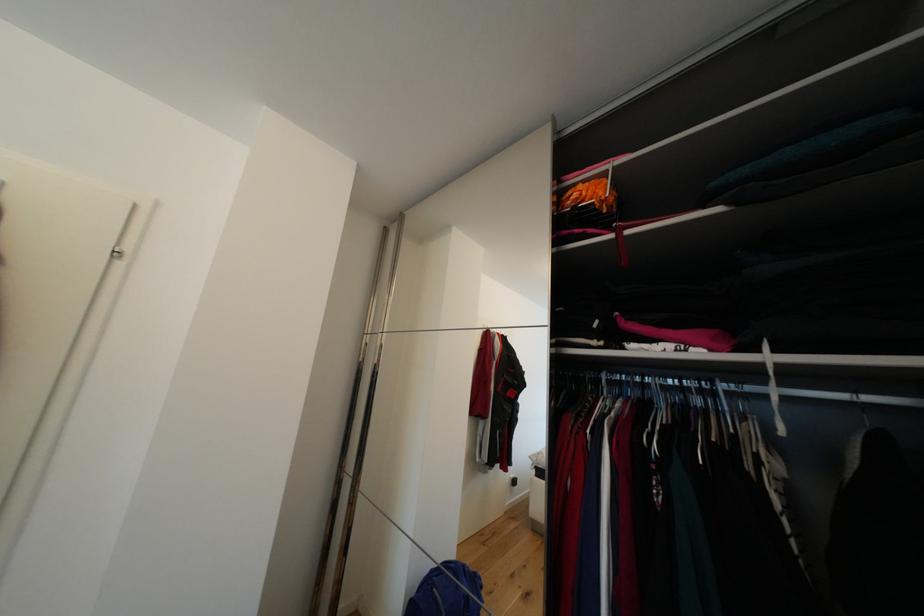
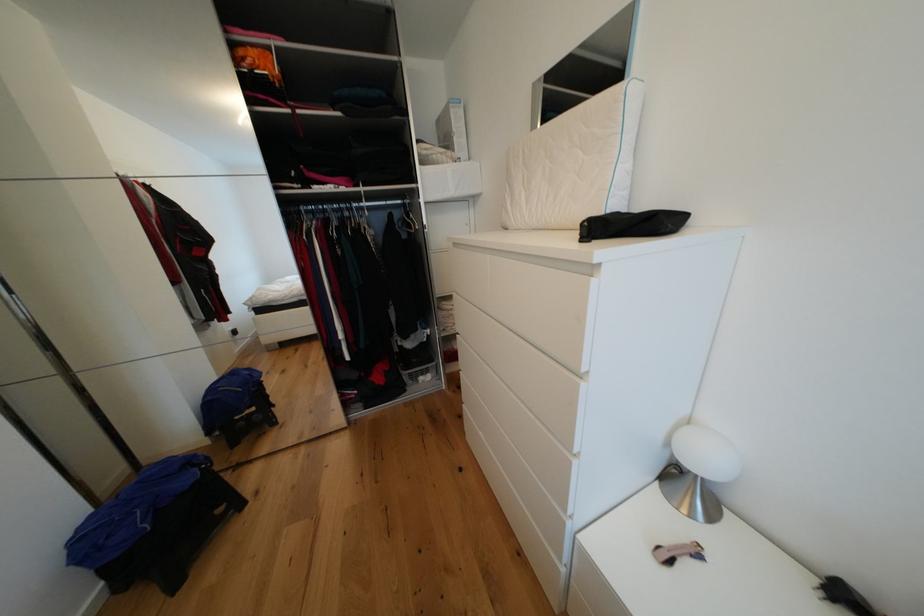
From the picture: The first image is from the beginning of the video and the second image is from the end. How did the camera likely rotate when shooting the video?

The camera rotated toward right-down.